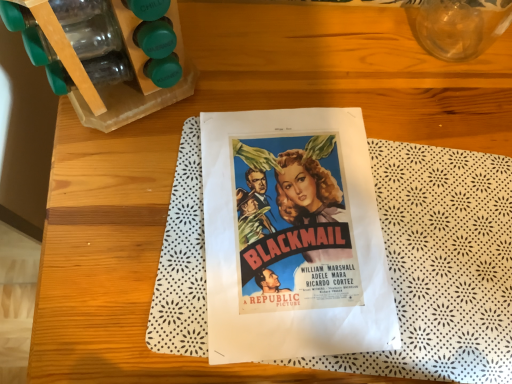
Image resolution: width=512 pixels, height=384 pixels. In order to click on vacant space situated on the left part of transparent glass vase at upper right in this screenshot , I will do `click(344, 55)`.